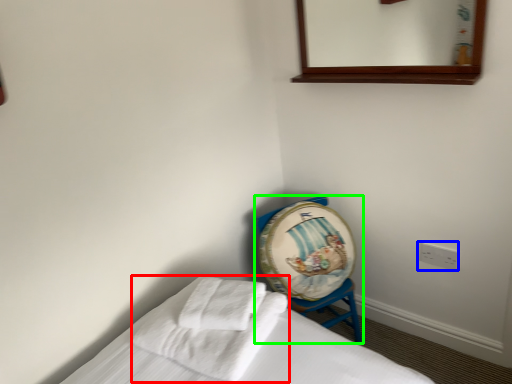
Question: Which object is positioned closest to bath towel (highlighted by a red box)? Select from electric outlet (highlighted by a blue box) and furniture (highlighted by a green box).

Choices:
 (A) electric outlet
 (B) furniture

Answer: (B)